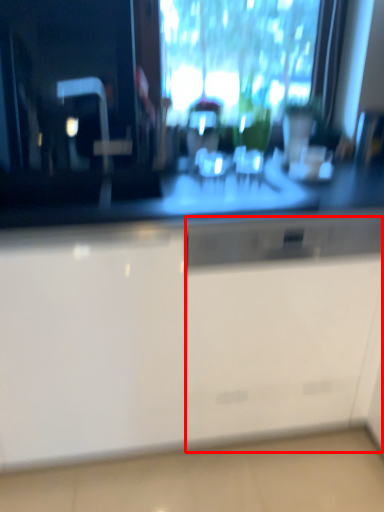
Question: From the image, what is the correct spatial relationship of file cabinet (annotated by the red box) in relation to cabinetry?

Choices:
 (A) right
 (B) left

Answer: (A)